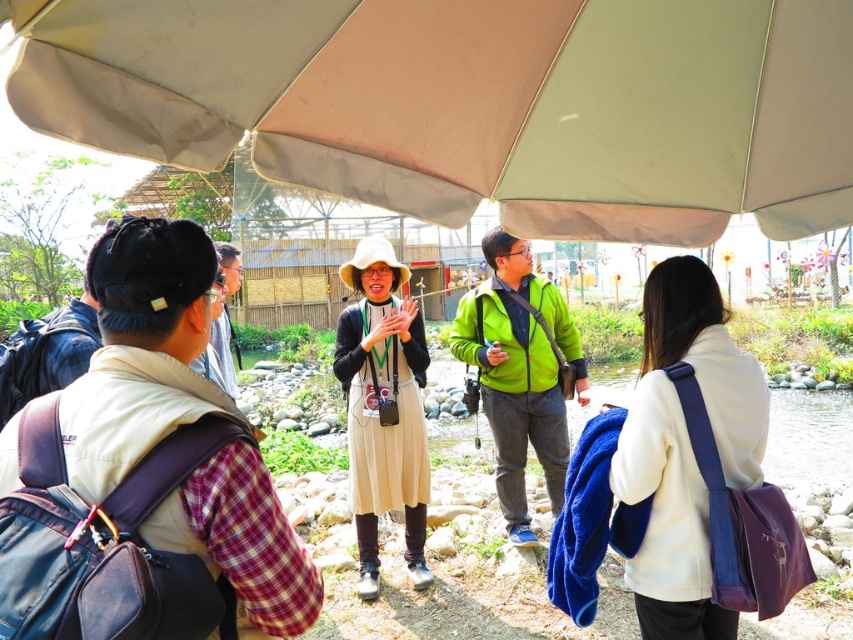
You are a photographer trying to capture a photo of the beige fabric dress at center without the beige fabric canopy at upper center blocking it. Since the canopy is shorter than the dress, where should you position yourself relative to the dress to ensure the canopy doesn

Since the beige fabric canopy at upper center is shorter than the beige fabric dress at center, positioning yourself at a lower angle or closer to the dress will allow you to frame the shot so the canopy doesn

You are a photographer positioned to the side of the scene. You want to capture a clear photo of the beige fabric dress at center without the beige fabric canopy at upper center blocking it. What adjustment should you make to your camera angle?

Lower your camera angle to avoid the beige fabric canopy at upper center, which is above the beige fabric dress at center.

Looking at this image, you are a photographer trying to capture a wide shot of the beige fabric canopy at upper center and the white fabric coat at lower right. Since you want both objects to appear balanced in the frame, which object should you zoom in on to make them look similar in size?

The beige fabric canopy at upper center is larger in size than the white fabric coat at lower right, so you should zoom in on the beige fabric canopy at upper center to reduce its size and balance it with the smaller white fabric coat at lower right.